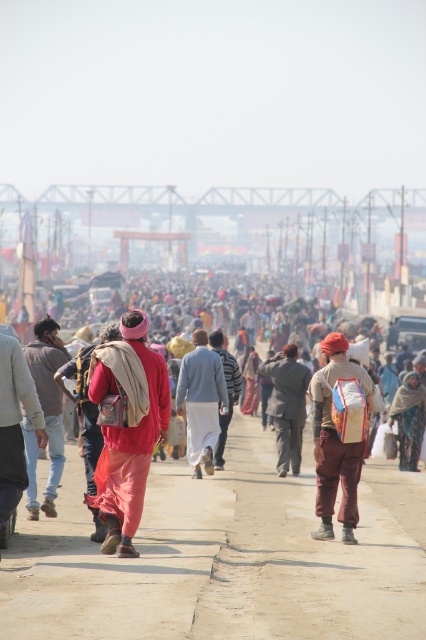
Is jeans at left above matte pink pants at center?

No, jeans at left is not above matte pink pants at center.

Between jeans at left and matte pink pants at center, which one is positioned lower?

jeans at left is below.

At what (x,y) coordinates should I click in order to perform the action: click on jeans at left. Please return your answer as a coordinate pair (x, y). The image size is (426, 640). Looking at the image, I should click on (45, 412).

What are the coordinates of `jeans at left` in the screenshot? It's located at (45, 412).

From the picture: Does matte pink pants at center appear on the left side of light gray cotton shirt at center?

Yes, matte pink pants at center is to the left of light gray cotton shirt at center.

Can you confirm if matte pink pants at center is thinner than light gray cotton shirt at center?

Correct, matte pink pants at center's width is less than light gray cotton shirt at center's.

Where is `matte pink pants at center`? This screenshot has width=426, height=640. matte pink pants at center is located at coordinates (14, 422).

The height and width of the screenshot is (640, 426). Find the location of `matte pink pants at center`. matte pink pants at center is located at coordinates (14, 422).

Can you confirm if dark gray fabric coat at center is taller than camouflage fabric bag at center?

No, dark gray fabric coat at center is not taller than camouflage fabric bag at center.

Is point (279, 396) farther from viewer compared to point (414, 413)?

No.

Describe the element at coordinates (287, 404) in the screenshot. Image resolution: width=426 pixels, height=640 pixels. I see `dark gray fabric coat at center` at that location.

Identify the location of dark gray fabric coat at center. Image resolution: width=426 pixels, height=640 pixels. (287, 404).